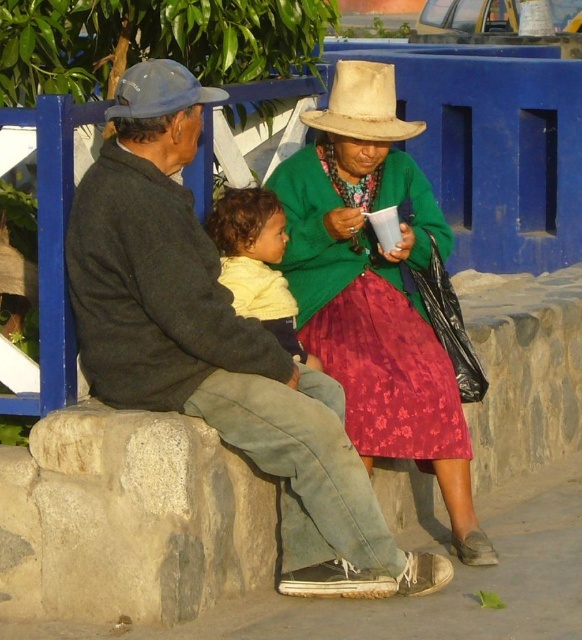
Question: Is the position of natural straw cowboy hat at center less distant than that of matte blue cowboy hat at upper left?

Choices:
 (A) yes
 (B) no

Answer: (B)

Question: Does dark gray woolen sweater at center appear over floral satin skirt at center?

Choices:
 (A) no
 (B) yes

Answer: (A)

Question: Which point is farther to the camera?

Choices:
 (A) matte blue cowboy hat at upper left
 (B) floral satin skirt at center
 (C) soft yellow sweater at center

Answer: (B)

Question: Estimate the real-world distances between objects in this image. Which object is farther from the soft yellow sweater at center?

Choices:
 (A) matte blue cowboy hat at upper left
 (B) green woven sweater at center

Answer: (A)

Question: Does green woven sweater at center come in front of soft yellow sweater at center?

Choices:
 (A) yes
 (B) no

Answer: (B)

Question: Which of the following is the closest to the observer?

Choices:
 (A) matte blue cowboy hat at upper left
 (B) floral satin skirt at center
 (C) dark gray woolen sweater at center

Answer: (C)